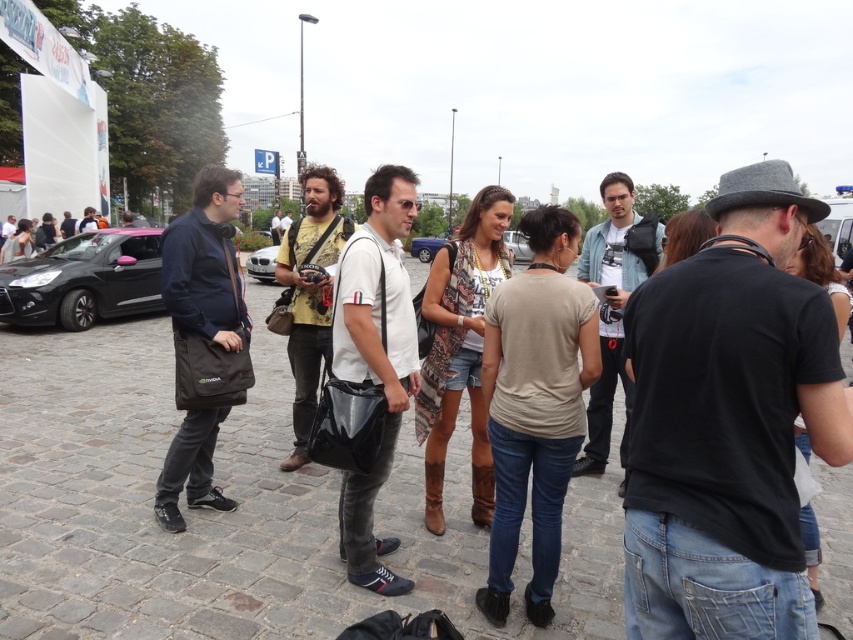
You are standing at the center of the image and see a point marked at coordinates (613, 305). What object is located at that point?

The point at coordinates (613, 305) indicates the location of the denim jacket at center.

You are standing at the edge of the scene and want to take a photo of the denim jacket at center and the silver metallic car at center. Which object should you focus on first if you want to capture both in the same frame without moving the camera?

You should focus on the denim jacket at center first because it is located below the silver metallic car at center, so adjusting the camera to include both would require ensuring the lower object is in frame before the upper one.

You are driving a car that is 4.5 meters long and need to park it in a space between the black matte car at left and the silver metallic car at center. Is there enough space to park your car there?

The distance between the black matte car at left and the silver metallic car at center is 6.08 meters. Since your car is 4.5 meters long, there is sufficient space to park between them as 6.08 meters is greater than 4.5 meters.